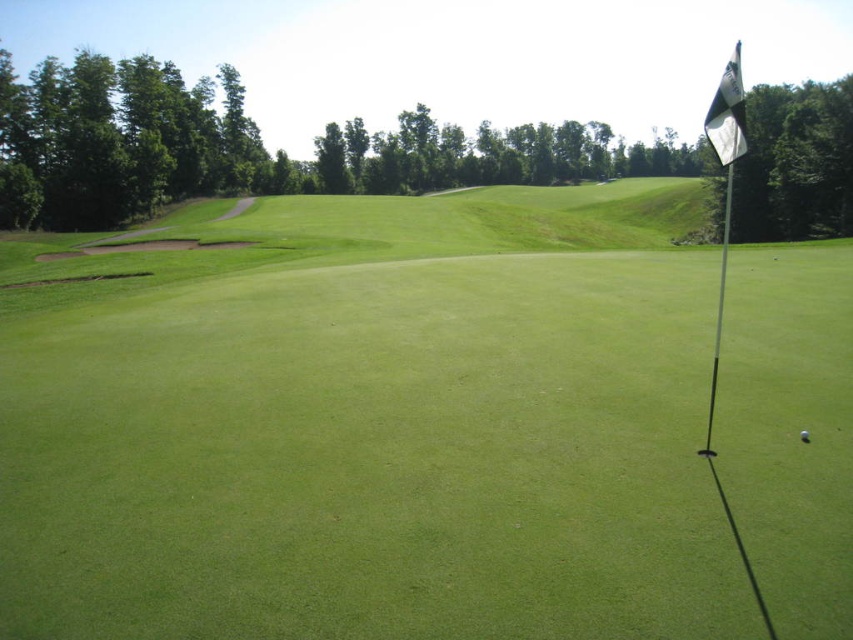
Can you confirm if green grassy golf course at center is positioned above white matte golf ball at center?

Yes.

Who is more distant from viewer, (427, 196) or (799, 433)?

Positioned behind is point (427, 196).

I want to click on green grassy golf course at center, so click(370, 426).

Is point (715, 92) positioned in front of point (805, 436)?

No, it is behind (805, 436).

Can you confirm if white fabric flag at upper right is wider than white matte golf ball at center?

Indeed, white fabric flag at upper right has a greater width compared to white matte golf ball at center.

At what (x,y) coordinates should I click in order to perform the action: click on white fabric flag at upper right. Please return your answer as a coordinate pair (x, y). Image resolution: width=853 pixels, height=640 pixels. Looking at the image, I should click on (727, 113).

This screenshot has width=853, height=640. What do you see at coordinates (718, 312) in the screenshot? I see `white plastic golf club at right` at bounding box center [718, 312].

Does point (709, 428) come in front of point (802, 438)?

No, it is behind (802, 438).

Who is more distant from viewer, (721, 307) or (805, 438)?

The point (721, 307) is more distant.

Identify the location of white plastic golf club at right. This screenshot has height=640, width=853. pyautogui.click(x=718, y=312).